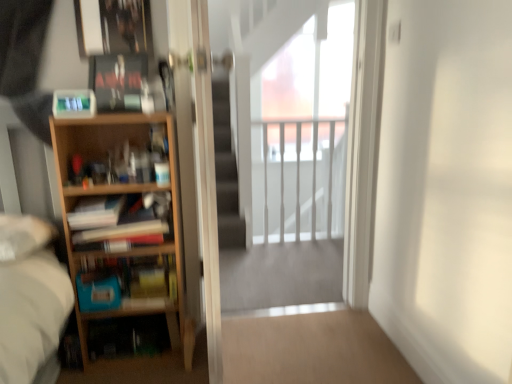
Question: Is transparent glass screen door at center, which is counted as the second screen door, starting from the left, far from metallic silver picture frame at upper left?

Choices:
 (A) yes
 (B) no

Answer: (A)

Question: Is metallic silver picture frame at upper left surrounded by transparent glass screen door at center, which is the 1th screen door in right-to-left order?

Choices:
 (A) no
 (B) yes

Answer: (A)

Question: Considering the relative sizes of transparent glass screen door at center, which is counted as the second screen door, starting from the left, and metallic silver picture frame at upper left in the image provided, is transparent glass screen door at center, which is counted as the second screen door, starting from the left, wider than metallic silver picture frame at upper left?

Choices:
 (A) no
 (B) yes

Answer: (B)

Question: From the image's perspective, is transparent glass screen door at center, which is counted as the second screen door, starting from the left, beneath metallic silver picture frame at upper left?

Choices:
 (A) no
 (B) yes

Answer: (B)

Question: Does transparent glass screen door at center, which is counted as the second screen door, starting from the left, lie behind metallic silver picture frame at upper left?

Choices:
 (A) no
 (B) yes

Answer: (B)

Question: Can you confirm if transparent glass screen door at center, which is counted as the second screen door, starting from the left, is taller than metallic silver picture frame at upper left?

Choices:
 (A) no
 (B) yes

Answer: (B)

Question: Does transparent glass screen door at center, the 2th screen door positioned from the right, have a greater width compared to wooden bookshelf at left, which is counted as the 3th book, starting from the top?

Choices:
 (A) no
 (B) yes

Answer: (B)

Question: Does transparent glass screen door at center, the 2th screen door positioned from the right, have a lesser height compared to wooden bookshelf at left, which is counted as the 3th book, starting from the top?

Choices:
 (A) no
 (B) yes

Answer: (A)

Question: Is the position of transparent glass screen door at center, the 1th screen door when ordered from left to right, less distant than that of wooden bookshelf at left, which is counted as the 3th book, starting from the top?

Choices:
 (A) no
 (B) yes

Answer: (B)

Question: From a real-world perspective, is transparent glass screen door at center, the 2th screen door positioned from the right, positioned over wooden bookshelf at left, which is counted as the 3th book, starting from the top, based on gravity?

Choices:
 (A) no
 (B) yes

Answer: (B)

Question: Can you confirm if transparent glass screen door at center, the 2th screen door positioned from the right, is bigger than wooden bookshelf at left, which appears as the 1th book when ordered from the bottom?

Choices:
 (A) yes
 (B) no

Answer: (A)

Question: Is transparent glass screen door at center, the 2th screen door positioned from the right, facing away from wooden bookshelf at left, which is counted as the 3th book, starting from the top?

Choices:
 (A) no
 (B) yes

Answer: (A)

Question: Can you confirm if light wood bookcase at left is thinner than white glossy railing at upper center?

Choices:
 (A) yes
 (B) no

Answer: (B)